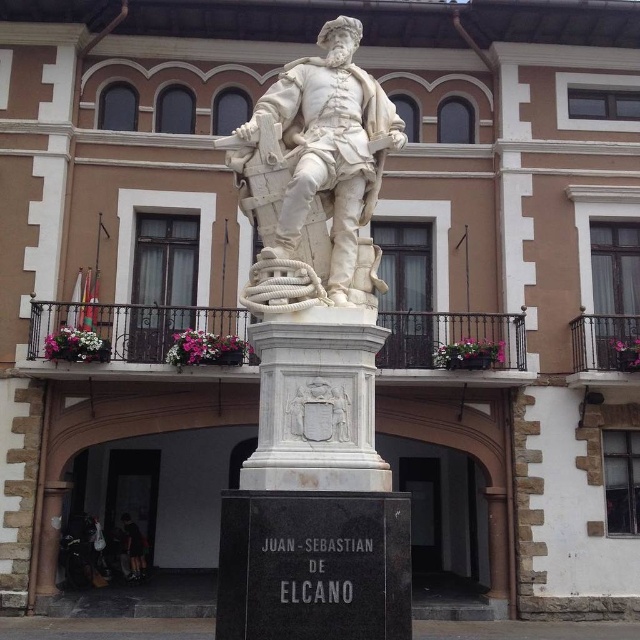
You are a tourist standing in front of the historic building and see the white marble statue at center and the white marble pedestal at center. Which object is positioned to the right side?

The white marble statue at center is positioned to the right of the white marble pedestal at center.

You are standing in front of the statue of Juan Sebasti n de Elcano. You need to place a wreath on the white marble pedestal at center. If you are currently 8 meters away from the pedestal, can you reach it without moving closer?

The white marble pedestal at center is 7.92 meters away from the camera. Since you are currently 8 meters away, you are slightly farther than the pedestal, so you need to move closer to reach it.

You are standing in front of the historic building and want to take a photo of the white marble statue at center. To ensure the statue is centered in your photo, where should you position yourself relative to the statue?

To center the white marble statue at center in your photo, position yourself directly in front of it at the point corresponding to its 2D location at coordinates approximately 0.247 on the x and 0.500 on the y axis.